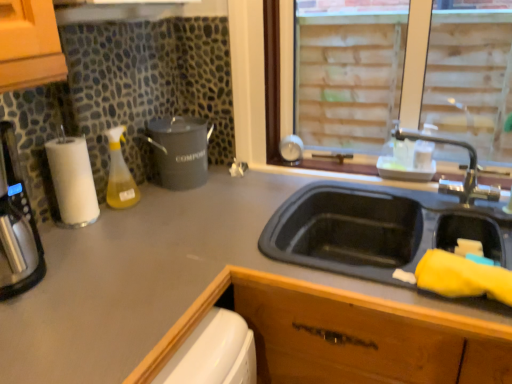
This screenshot has width=512, height=384. In order to click on vacant space to the right of white paper towel at left in this screenshot , I will do `click(133, 215)`.